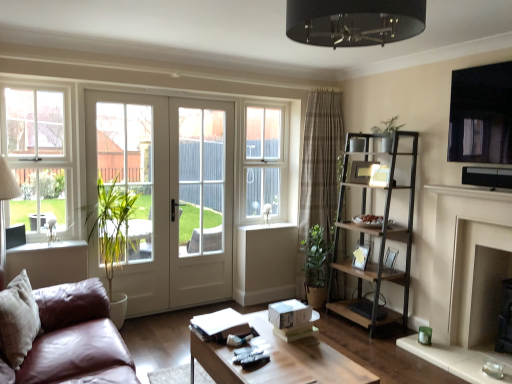
Identify the location of vacant point to the left of white matte fireplace at right. (407, 364).